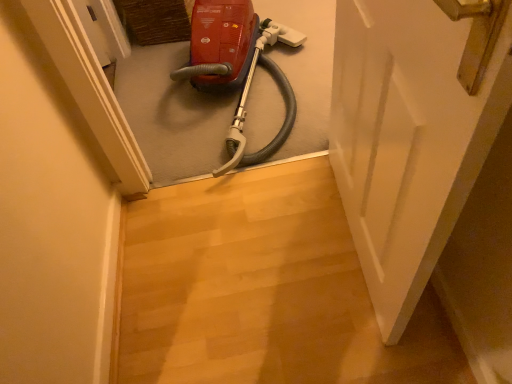
Question: Is white matte door at center with matte red vacuum cleaner at center?

Choices:
 (A) no
 (B) yes

Answer: (A)

Question: Is white matte door at center smaller than matte red vacuum cleaner at center?

Choices:
 (A) yes
 (B) no

Answer: (A)

Question: From the image's perspective, is white matte door at center located above matte red vacuum cleaner at center?

Choices:
 (A) no
 (B) yes

Answer: (A)

Question: Is white matte door at center to the left of matte red vacuum cleaner at center from the viewer's perspective?

Choices:
 (A) no
 (B) yes

Answer: (A)

Question: From a real-world perspective, is white matte door at center positioned over matte red vacuum cleaner at center based on gravity?

Choices:
 (A) no
 (B) yes

Answer: (B)

Question: Could matte red vacuum cleaner at center be considered to be inside white matte door at center?

Choices:
 (A) no
 (B) yes

Answer: (A)

Question: Considering the relative positions of matte red vacuum cleaner at center and white matte door at center in the image provided, is matte red vacuum cleaner at center in front of white matte door at center?

Choices:
 (A) yes
 (B) no

Answer: (B)

Question: Is matte red vacuum cleaner at center oriented away from white matte door at center?

Choices:
 (A) no
 (B) yes

Answer: (A)

Question: From the image's perspective, is matte red vacuum cleaner at center on white matte door at center?

Choices:
 (A) no
 (B) yes

Answer: (B)

Question: Is matte red vacuum cleaner at center to the left of white matte door at center from the viewer's perspective?

Choices:
 (A) yes
 (B) no

Answer: (A)

Question: Is matte red vacuum cleaner at center to the right of white matte door at center from the viewer's perspective?

Choices:
 (A) yes
 (B) no

Answer: (B)

Question: Can you confirm if matte red vacuum cleaner at center is wider than white matte door at center?

Choices:
 (A) yes
 (B) no

Answer: (A)

Question: In the image, is matte red vacuum cleaner at center positioned in front of or behind white matte door at center?

Choices:
 (A) front
 (B) behind

Answer: (B)